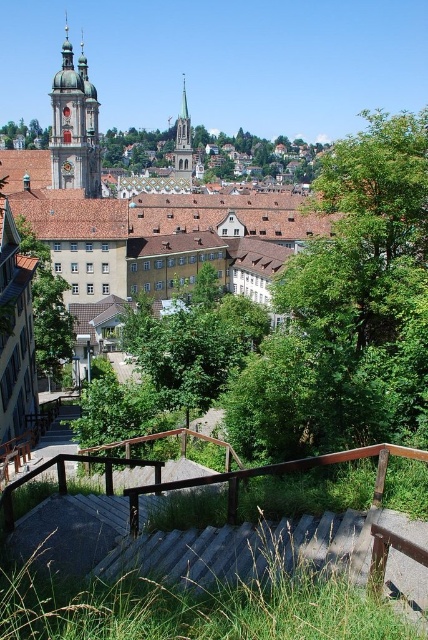
Question: Can you confirm if green leafy tree at center is positioned to the right of green leafy tree at upper center?

Choices:
 (A) no
 (B) yes

Answer: (B)

Question: Which object is closer to the camera taking this photo?

Choices:
 (A) green leafy tree at upper center
 (B) green leafy tree at center
 (C) gold-plated spire at upper left

Answer: (B)

Question: Does green leafy tree at center have a lesser width compared to green leafy tree at upper center?

Choices:
 (A) yes
 (B) no

Answer: (A)

Question: Which of the following is the closest to the observer?

Choices:
 (A) (44, 269)
 (B) (65, 33)
 (C) (314, 563)

Answer: (C)

Question: Which object is the farthest from the gold-plated spire at upper left?

Choices:
 (A) green leafy tree at upper center
 (B) brown wooden rail at lower center
 (C) green leafy tree at center

Answer: (B)

Question: Can you confirm if gold-plated spire at upper left is wider than green stone church steeple at center?

Choices:
 (A) yes
 (B) no

Answer: (B)